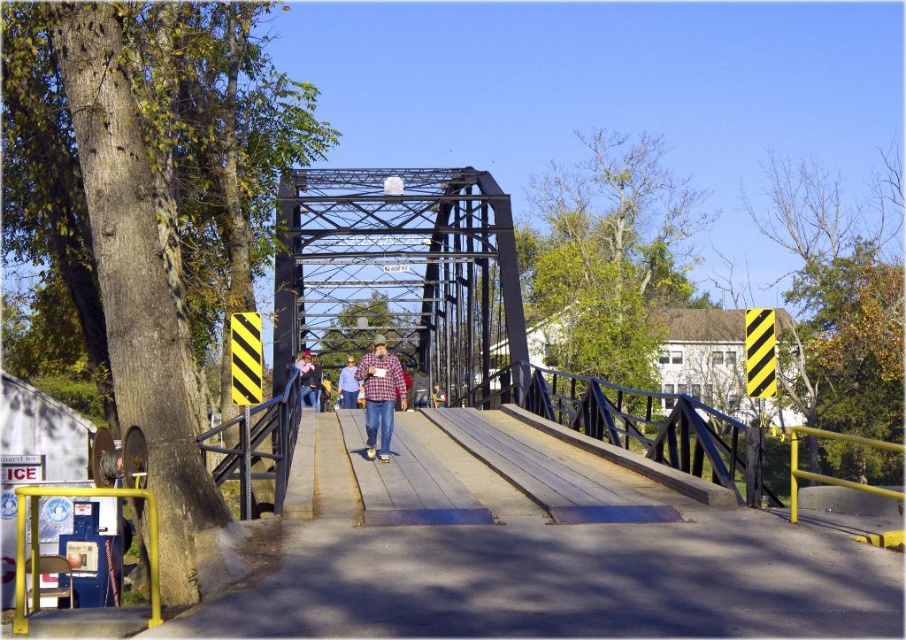
You are standing on the bridge and notice a person wearing a matte pink shirt. Based on the scene description, where would you look to see the matte pink shirt at center relative to the black metal bridge at center?

The matte pink shirt at center is to the left of the black metal bridge at center because the black metal bridge at center is to the right of the matte pink shirt at center.

You are a hiker standing at the base of the black metal bridge at center and the denim jacket at center. You want to take a photo of both objects in the same frame. Which object should you focus on first to ensure both are in the frame?

The black metal bridge at center is taller than the denim jacket at center, so you should focus on the black metal bridge at center first to ensure both are in the frame.

You are standing on the black metal bridge at center and want to hand a denim jacket at center to someone across the bridge. Since the bridge is narrow, you need to step aside. Which direction should you move to ensure the person can reach the jacket without obstruction?

You should move towards the black metal bridge at center because it is closer to the viewer than the denim jacket at center, so stepping toward the bridge would allow the person to reach the jacket more easily.